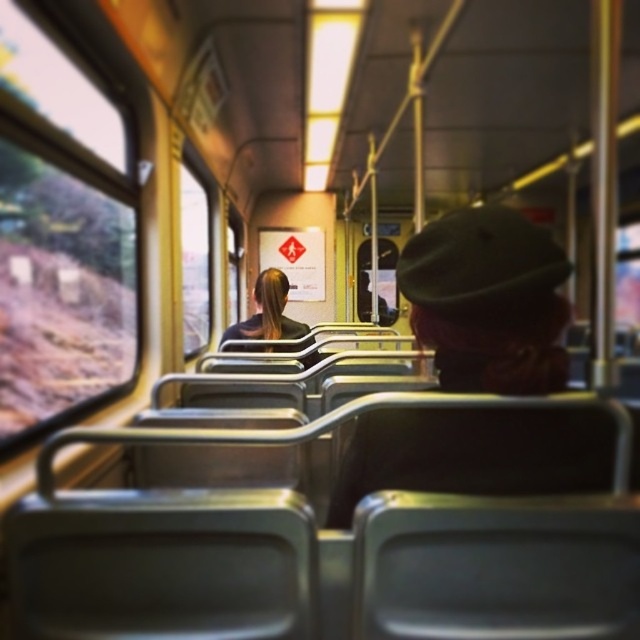
Question: Which object is farther from the camera taking this photo?

Choices:
 (A) black fabric hair at center
 (B) transparent glass window at center

Answer: (B)

Question: Does transparent glass window at center lie in front of black fabric hair at center?

Choices:
 (A) no
 (B) yes

Answer: (A)

Question: Where is transparent glass window at center located in relation to black fabric hair at center in the image?

Choices:
 (A) above
 (B) below

Answer: (A)

Question: Among these points, which one is nearest to the camera?

Choices:
 (A) (182, 301)
 (B) (246, 339)

Answer: (B)

Question: Does transparent glass window at center have a greater width compared to black fabric hair at center?

Choices:
 (A) yes
 (B) no

Answer: (B)